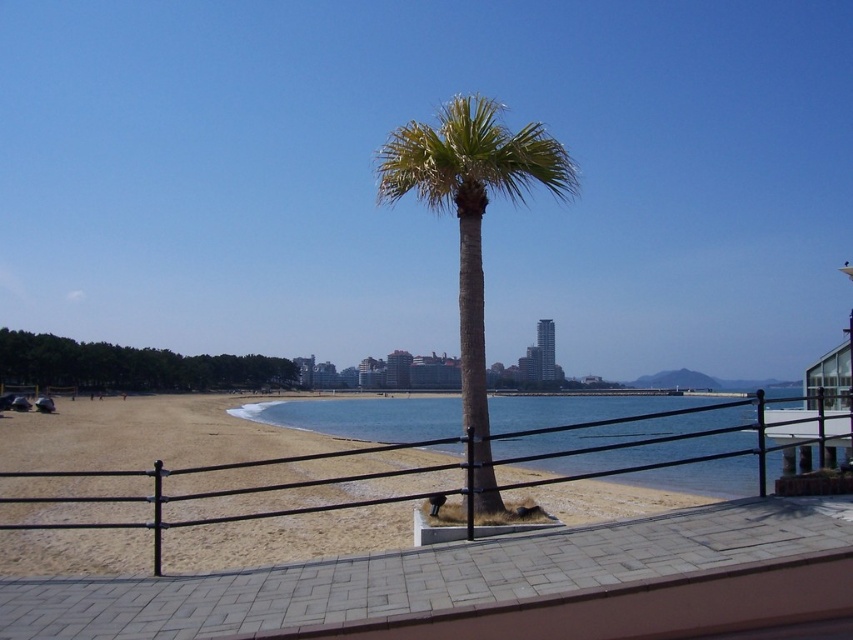
Question: Which is nearer to the green leafy palm tree at center?

Choices:
 (A) black metal fence at center
 (B) clear blue water at center

Answer: (A)

Question: Does clear blue water at center have a lesser width compared to green leafy palm tree at center?

Choices:
 (A) no
 (B) yes

Answer: (A)

Question: Which object is closer to the camera taking this photo?

Choices:
 (A) green leafy palm tree at center
 (B) clear blue water at center
 (C) black metal fence at center

Answer: (B)

Question: Estimate the real-world distances between objects in this image. Which object is farther from the black metal fence at center?

Choices:
 (A) clear blue water at center
 (B) green leafy palm tree at center

Answer: (B)

Question: Does black metal fence at center have a greater width compared to green leafy palm tree at center?

Choices:
 (A) no
 (B) yes

Answer: (B)

Question: Observing the image, what is the correct spatial positioning of clear blue water at center in reference to green leafy palm tree at center?

Choices:
 (A) below
 (B) above

Answer: (A)